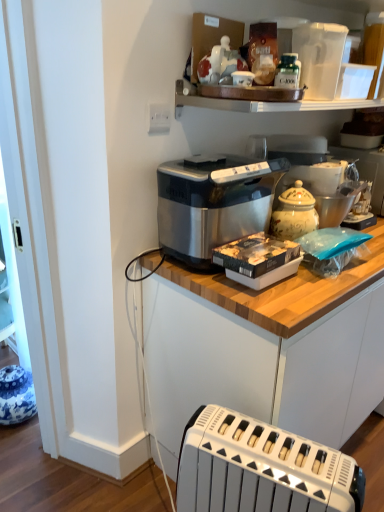
What do you see at coordinates (326, 188) in the screenshot?
I see `white ceramic jar at upper right, the 2th appliance in the bottom-to-top sequence` at bounding box center [326, 188].

In order to face green glass bottle at upper center, should I rotate leftwards or rightwards?

You should look right and rotate roughly 12.537 degrees.

The width and height of the screenshot is (384, 512). What do you see at coordinates (16, 395) in the screenshot?
I see `blue and white ceramic vase at lower left, which appears as the 1th appliance when ordered from the bottom` at bounding box center [16, 395].

How much space does blue and white ceramic vase at lower left, which appears as the 1th appliance when ordered from the bottom, occupy horizontally?

blue and white ceramic vase at lower left, which appears as the 1th appliance when ordered from the bottom, is 9.63 inches in width.

Where is `satin metallic bread maker at center`? The image size is (384, 512). satin metallic bread maker at center is located at coordinates (213, 203).

What do you see at coordinates (261, 469) in the screenshot? I see `white plastic toaster at lower center` at bounding box center [261, 469].

Locate an element on the screen. white ceramic jar at upper right, the 2th appliance viewed from the top is located at coordinates (326, 188).

Is the position of white plastic electric outlet at upper center less distant than that of satin silver toaster at center?

No, white plastic electric outlet at upper center is further to the viewer.

Is white plastic electric outlet at upper center wider or thinner than satin silver toaster at center?

Considering their sizes, white plastic electric outlet at upper center looks slimmer than satin silver toaster at center.

From a real-world perspective, is white plastic electric outlet at upper center positioned under satin silver toaster at center based on gravity?

Incorrect, from a real-world perspective, white plastic electric outlet at upper center is higher than satin silver toaster at center.

From the image's perspective, is white plastic electric outlet at upper center located above or below satin silver toaster at center?

white plastic electric outlet at upper center is above satin silver toaster at center.

Does point (287, 83) appear closer or farther from the camera than point (343, 200)?

Point (287, 83) appears to be closer to the viewer than point (343, 200).

Does green glass bottle at upper center come in front of white ceramic jar at upper right, the 2th appliance viewed from the top?

Yes, green glass bottle at upper center is closer to the camera.

Is green glass bottle at upper center inside the boundaries of white ceramic jar at upper right, which is counted as the first appliance, starting from the right, or outside?

green glass bottle at upper center exists outside the volume of white ceramic jar at upper right, which is counted as the first appliance, starting from the right.

Is green glass bottle at upper center not close to white ceramic jar at upper right, the 2th appliance in the bottom-to-top sequence?

They are positioned close to each other.

Who is bigger, white ceramic jar at upper right, which is counted as the first appliance, starting from the right, or blue and white ceramic vase at lower left, acting as the third appliance starting from the top?

white ceramic jar at upper right, which is counted as the first appliance, starting from the right, is bigger.

In the scene shown: Would you say white ceramic jar at upper right, the 2th appliance in the bottom-to-top sequence, contains blue and white ceramic vase at lower left, the first appliance when ordered from left to right?

No, white ceramic jar at upper right, the 2th appliance in the bottom-to-top sequence, does not contain blue and white ceramic vase at lower left, the first appliance when ordered from left to right.

How distant is white ceramic jar at upper right, which is counted as the first appliance, starting from the right, from blue and white ceramic vase at lower left, acting as the third appliance starting from the right?

white ceramic jar at upper right, which is counted as the first appliance, starting from the right, is 4.96 feet away from blue and white ceramic vase at lower left, acting as the third appliance starting from the right.

Is white ceramic jar at upper right, the 2th appliance in the bottom-to-top sequence, positioned behind blue and white ceramic vase at lower left, acting as the third appliance starting from the top?

No, white ceramic jar at upper right, the 2th appliance in the bottom-to-top sequence, is closer to the camera.

From the picture: From a real-world perspective, is satin silver toaster at center physically located above or below blue and white ceramic vase at lower left, which appears as the 1th appliance when ordered from the bottom?

satin silver toaster at center is situated higher than blue and white ceramic vase at lower left, which appears as the 1th appliance when ordered from the bottom, in the real world.

What's the angular difference between satin silver toaster at center and blue and white ceramic vase at lower left, acting as the third appliance starting from the top,'s facing directions?

The facing directions of satin silver toaster at center and blue and white ceramic vase at lower left, acting as the third appliance starting from the top, are 91.2 degrees apart.

Locate an element on the screen. The width and height of the screenshot is (384, 512). the 2nd appliance counting from the left side of the satin silver toaster at center is located at coordinates (16, 395).

Is satin silver toaster at center to the right of green glass bottle at upper center from the viewer's perspective?

Yes.

How many degrees apart are the facing directions of satin silver toaster at center and green glass bottle at upper center?

6.56 degrees separate the facing orientations of satin silver toaster at center and green glass bottle at upper center.

From a real-world perspective, which object stands above the other?

green glass bottle at upper center, from a real-world perspective.

Which is in front, green glass bottle at upper center or satin metallic bread maker at center?

satin metallic bread maker at center is closer to the camera.

Is green glass bottle at upper center surrounding satin metallic bread maker at center?

No, satin metallic bread maker at center is located outside of green glass bottle at upper center.

Could you tell me if green glass bottle at upper center is turned towards satin metallic bread maker at center?

No, green glass bottle at upper center is not turned towards satin metallic bread maker at center.

From a real-world perspective, relative to blue and white ceramic vase at lower left, acting as the third appliance starting from the top, is white plastic toaster at lower center vertically above or below?

Clearly, from a real-world perspective, white plastic toaster at lower center is above blue and white ceramic vase at lower left, acting as the third appliance starting from the top.

Considering the sizes of objects white plastic toaster at lower center and blue and white ceramic vase at lower left, which appears as the 1th appliance when ordered from the bottom, in the image provided, who is shorter, white plastic toaster at lower center or blue and white ceramic vase at lower left, which appears as the 1th appliance when ordered from the bottom,?

blue and white ceramic vase at lower left, which appears as the 1th appliance when ordered from the bottom.

Is the position of white plastic toaster at lower center less distant than that of blue and white ceramic vase at lower left, acting as the third appliance starting from the right?

Yes, it is in front of blue and white ceramic vase at lower left, acting as the third appliance starting from the right.

Would you say white plastic toaster at lower center is inside or outside blue and white ceramic vase at lower left, the first appliance when ordered from left to right?

white plastic toaster at lower center is spatially situated outside blue and white ceramic vase at lower left, the first appliance when ordered from left to right.

I want to click on cabinetry below the white plastic electric outlet at upper center (from a real-world perspective), so click(x=267, y=348).

This screenshot has height=512, width=384. Find the location of `the 2nd appliance behind the green glass bottle at upper center, starting your count from the anchor`. the 2nd appliance behind the green glass bottle at upper center, starting your count from the anchor is located at coordinates click(326, 188).

Estimate the real-world distances between objects in this image. Which object is closer to green glass bottle at upper center, satin metallic bread maker at center or blue and white ceramic vase at lower left, acting as the third appliance starting from the top?

satin metallic bread maker at center is closer to green glass bottle at upper center.

Consider the image. Considering their positions, is white plastic pitcher at upper right, which is the 3th appliance in bottom-to-top order, positioned closer to white plastic toaster at lower center than satin metallic bread maker at center?

satin metallic bread maker at center.

Estimate the real-world distances between objects in this image. Which object is further from satin silver toaster at center, white plastic pitcher at upper right, which is counted as the 1th appliance, starting from the top, or white plastic electric outlet at upper center?

Based on the image, white plastic electric outlet at upper center appears to be further to satin silver toaster at center.

Estimate the real-world distances between objects in this image. Which object is closer to green glass bottle at upper center, white plastic toaster at lower center or blue and white ceramic vase at lower left, acting as the third appliance starting from the top?

Based on the image, white plastic toaster at lower center appears to be nearer to green glass bottle at upper center.

Estimate the real-world distances between objects in this image. Which object is further from blue and white ceramic vase at lower left, acting as the third appliance starting from the right, white plastic toaster at lower center or white plastic electric outlet at upper center?

The object further to blue and white ceramic vase at lower left, acting as the third appliance starting from the right, is white plastic electric outlet at upper center.

From the image, which object appears to be farther from white ceramic jar at upper right, the 2th appliance in the bottom-to-top sequence, satin silver toaster at center or white plastic toaster at lower center?

Based on the image, white plastic toaster at lower center appears to be further to white ceramic jar at upper right, the 2th appliance in the bottom-to-top sequence.

Which object lies further to the anchor point blue and white ceramic vase at lower left, the first appliance when ordered from left to right, white plastic electric outlet at upper center or white ceramic jar at upper right, which is counted as the first appliance, starting from the right?

white ceramic jar at upper right, which is counted as the first appliance, starting from the right, lies further to blue and white ceramic vase at lower left, the first appliance when ordered from left to right, than the other object.

From the image, which object appears to be farther from blue and white ceramic vase at lower left, which appears as the 1th appliance when ordered from the bottom, white plastic pitcher at upper right, which is counted as the 2th appliance, starting from the right, or white plastic toaster at lower center?

white plastic pitcher at upper right, which is counted as the 2th appliance, starting from the right, is positioned further to the anchor blue and white ceramic vase at lower left, which appears as the 1th appliance when ordered from the bottom.

Where is `electric outlet between green glass bottle at upper center and satin silver toaster at center in the up-down direction`? The width and height of the screenshot is (384, 512). electric outlet between green glass bottle at upper center and satin silver toaster at center in the up-down direction is located at coordinates (159, 118).

I want to click on bottle between white plastic pitcher at upper right, which is counted as the 2th appliance, starting from the right, and satin silver toaster at center, in the vertical direction, so click(287, 71).

Where is `home appliance between blue and white ceramic vase at lower left, acting as the third appliance starting from the top, and white plastic toaster at lower center from left to right`? The height and width of the screenshot is (512, 384). home appliance between blue and white ceramic vase at lower left, acting as the third appliance starting from the top, and white plastic toaster at lower center from left to right is located at coordinates (213, 203).

At what (x,y) coordinates should I click in order to perform the action: click on home appliance between white plastic pitcher at upper right, the 2th appliance viewed from the left, and satin silver toaster at center in the up-down direction. Please return your answer as a coordinate pair (x, y). Image resolution: width=384 pixels, height=512 pixels. Looking at the image, I should click on (213, 203).